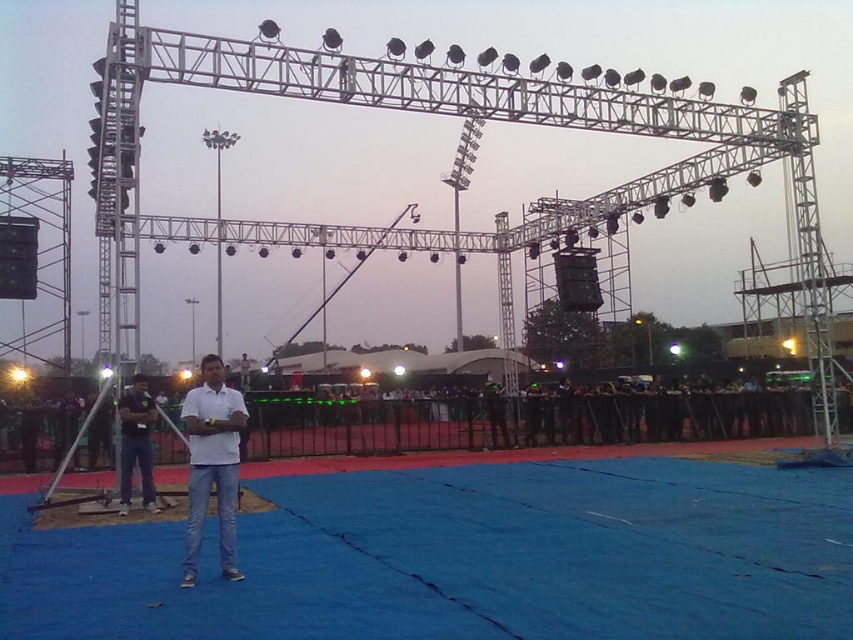
Is white cotton shirt at center positioned at the back of dark blue jeans at center?

No, white cotton shirt at center is closer to the viewer.

Can you confirm if white cotton shirt at center is taller than dark blue jeans at center?

Yes, white cotton shirt at center is taller than dark blue jeans at center.

Is point (201, 508) positioned before point (125, 429)?

Yes.

Where is `white cotton shirt at center`? white cotton shirt at center is located at coordinates (212, 464).

Can you confirm if blue fabric at center is positioned above white cotton shirt at center?

No, blue fabric at center is not above white cotton shirt at center.

Describe the element at coordinates (466, 557) in the screenshot. I see `blue fabric at center` at that location.

You are a GUI agent. You are given a task and a screenshot of the screen. Output one action in this format:
    pyautogui.click(x=<x>, y=<y>)
    Task: Click on the blue fabric at center
    
    Given the screenshot: What is the action you would take?
    pyautogui.click(x=466, y=557)

Identify the location of blue fabric at center. (466, 557).

Can you confirm if blue fabric at center is taller than dark blue jeans at center?

No, blue fabric at center is not taller than dark blue jeans at center.

The image size is (853, 640). What do you see at coordinates (466, 557) in the screenshot?
I see `blue fabric at center` at bounding box center [466, 557].

The width and height of the screenshot is (853, 640). Find the location of `blue fabric at center`. blue fabric at center is located at coordinates (466, 557).